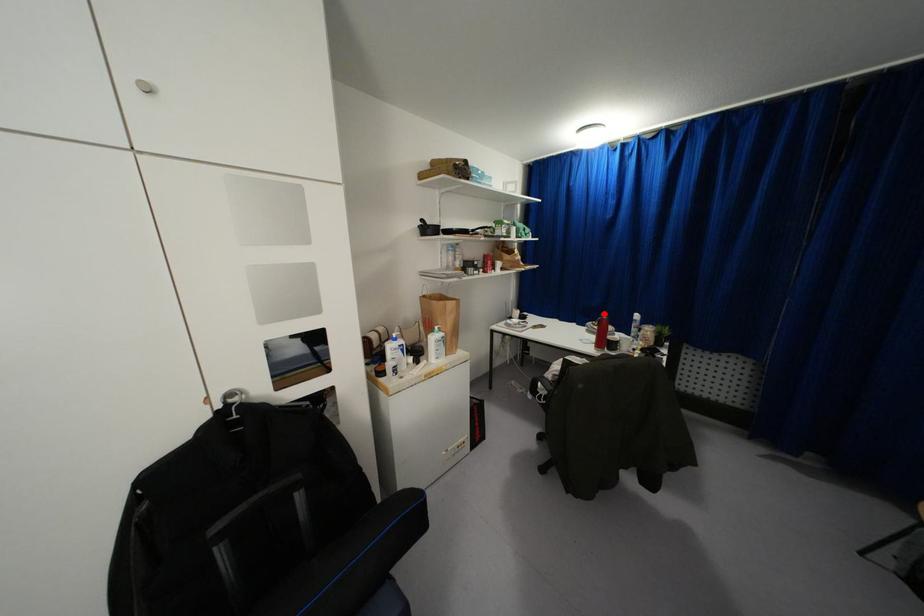
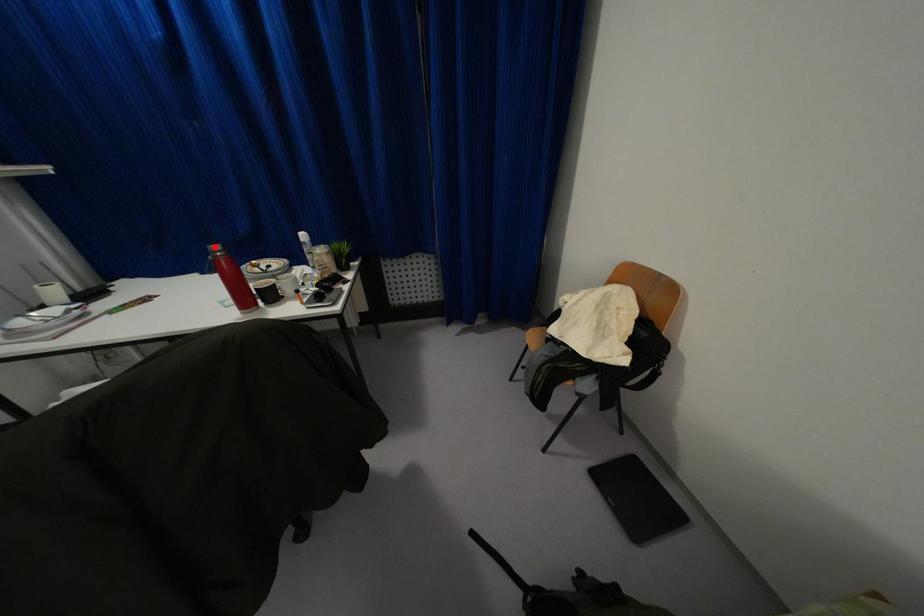
I am providing you with two images of the same scene from different viewpoints. A red point is marked on the first image and another point is marked on the second image. Are the points marked in image1 and image2 representing the same 3D position?

Yes